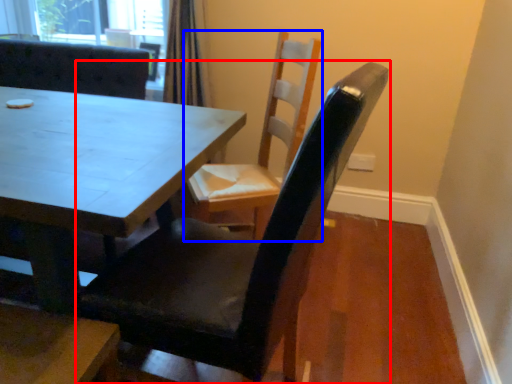
Question: Which object appears farthest to the camera in this image, chair (highlighted by a red box) or chair (highlighted by a blue box)?

Choices:
 (A) chair
 (B) chair

Answer: (B)